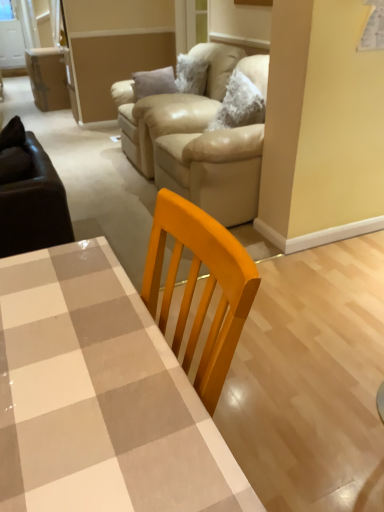
Describe the element at coordinates (99, 397) in the screenshot. I see `checkered glossy table at center` at that location.

This screenshot has width=384, height=512. I want to click on beige leather couch at upper center, so click(207, 159).

You are a GUI agent. You are given a task and a screenshot of the screen. Output one action in this format:
    pyautogui.click(x=<x>, y=<y>)
    Task: Click on the table on the left of beige leather couch at upper center
    
    Given the screenshot: What is the action you would take?
    pyautogui.click(x=99, y=397)

Is point (172, 506) more distant than point (159, 140)?

That is False.

Is checkered glossy table at center shorter than beige leather couch at upper center?

Yes, checkered glossy table at center is shorter than beige leather couch at upper center.

Considering the relative positions of checkered glossy table at center and beige leather couch at upper center in the image provided, is checkered glossy table at center to the right of beige leather couch at upper center from the viewer's perspective?

Incorrect, checkered glossy table at center is not on the right side of beige leather couch at upper center.

Can you confirm if checkered glossy table at center is positioned to the left of beige leather armchair at upper center?

Correct, you'll find checkered glossy table at center to the left of beige leather armchair at upper center.

How much distance is there between checkered glossy table at center and beige leather armchair at upper center?

checkered glossy table at center is 7.65 feet away from beige leather armchair at upper center.

Find the location of a particular element. table located on the left of beige leather armchair at upper center is located at coordinates (99, 397).

Based on the photo, which is in front, beige leather couch at upper center or checkered glossy table at center?

checkered glossy table at center.

Is beige leather couch at upper center looking in the opposite direction of checkered glossy table at center?

That's not correct — beige leather couch at upper center is not looking away from checkered glossy table at center.

Which of these two, beige leather couch at upper center or checkered glossy table at center, is wider?

beige leather couch at upper center is wider.

Measure the distance between beige leather couch at upper center and checkered glossy table at center.

beige leather couch at upper center is 5.65 feet from checkered glossy table at center.

From the image's perspective, is beige leather couch at upper center over beige leather armchair at upper center?

Incorrect, from the image's perspective, beige leather couch at upper center is lower than beige leather armchair at upper center.

Is beige leather couch at upper center oriented away from beige leather armchair at upper center?

No, beige leather armchair at upper center is not at the back of beige leather couch at upper center.

Is point (198, 170) less distant than point (224, 85)?

Yes.

Image resolution: width=384 pixels, height=512 pixels. There is a beige leather armchair at upper center. What are the coordinates of `couch above it (from a real-world perspective)` in the screenshot? It's located at (207, 159).

Is beige leather armchair at upper center to the left or to the right of checkered glossy table at center in the image?

beige leather armchair at upper center is positioned on checkered glossy table at center's right side.

Is beige leather armchair at upper center far away from checkered glossy table at center?

That's right, there is a large distance between beige leather armchair at upper center and checkered glossy table at center.

Does point (197, 97) lie behind point (64, 479)?

Yes, point (197, 97) is farther from viewer.

From a real-world perspective, is beige leather armchair at upper center over beige leather couch at upper center?

No, from a real-world perspective, beige leather armchair at upper center is not on top of beige leather couch at upper center.

Which object is thinner, beige leather armchair at upper center or beige leather couch at upper center?

beige leather couch at upper center.

Based on the photo, is beige leather armchair at upper center smaller than beige leather couch at upper center?

Yes.

Is point (146, 102) closer or farther from the camera than point (261, 160)?

Clearly, point (146, 102) is more distant from the camera than point (261, 160).

At what (x,y) coordinates should I click in order to perform the action: click on couch on the right of checkered glossy table at center. Please return your answer as a coordinate pair (x, y). The width and height of the screenshot is (384, 512). Looking at the image, I should click on (207, 159).

Image resolution: width=384 pixels, height=512 pixels. I want to click on table below the beige leather armchair at upper center (from a real-world perspective), so click(x=99, y=397).

Which object lies further to the anchor point beige leather couch at upper center, beige leather armchair at upper center or checkered glossy table at center?

checkered glossy table at center lies further to beige leather couch at upper center than the other object.

From the picture: Estimate the real-world distances between objects in this image. Which object is further from beige leather armchair at upper center, checkered glossy table at center or beige leather couch at upper center?

checkered glossy table at center is further to beige leather armchair at upper center.

Based on the photo, estimate the real-world distances between objects in this image. Which object is closer to beige leather armchair at upper center, beige leather couch at upper center or checkered glossy table at center?

beige leather couch at upper center is closer to beige leather armchair at upper center.

Considering their positions, is beige leather couch at upper center positioned closer to checkered glossy table at center than beige leather armchair at upper center?

The object closer to checkered glossy table at center is beige leather couch at upper center.

From the image, which object appears to be farther from beige leather couch at upper center, checkered glossy table at center or beige leather armchair at upper center?

checkered glossy table at center is positioned further to the anchor beige leather couch at upper center.

When comparing their distances from checkered glossy table at center, does beige leather armchair at upper center or beige leather couch at upper center seem further?

The object further to checkered glossy table at center is beige leather armchair at upper center.

This screenshot has height=512, width=384. In order to click on couch between checkered glossy table at center and beige leather armchair at upper center in the front-back direction in this screenshot , I will do `click(207, 159)`.